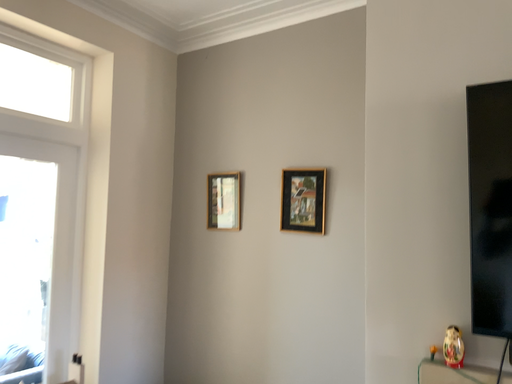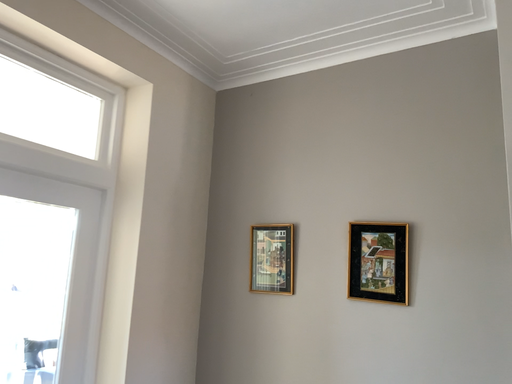
Question: How did the camera likely rotate when shooting the video?

Choices:
 (A) rotated upward
 (B) rotated downward

Answer: (A)